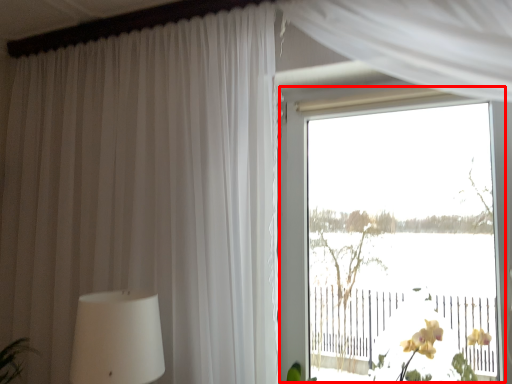
Question: From the image's perspective, what is the correct spatial positioning of window (annotated by the red box) in reference to rail?

Choices:
 (A) below
 (B) above

Answer: (B)